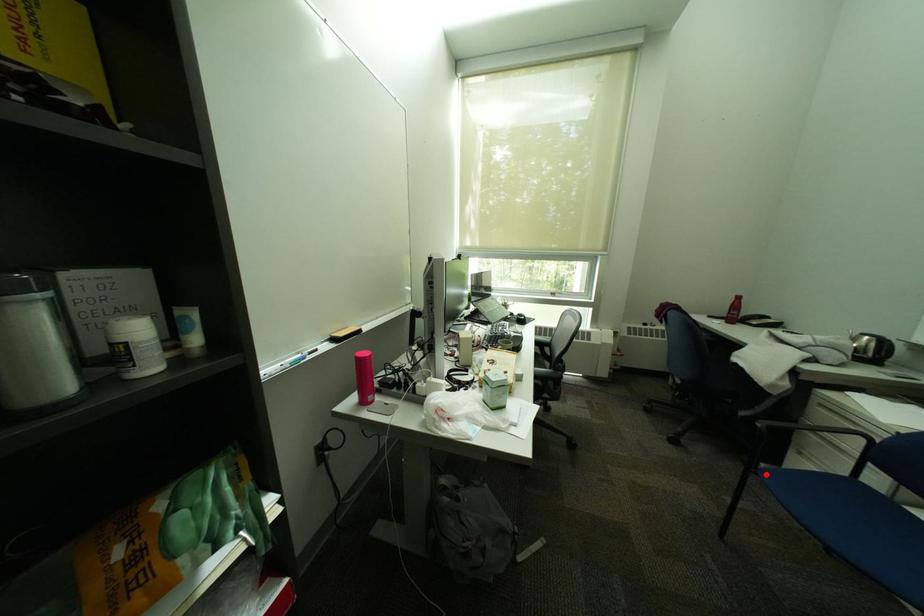
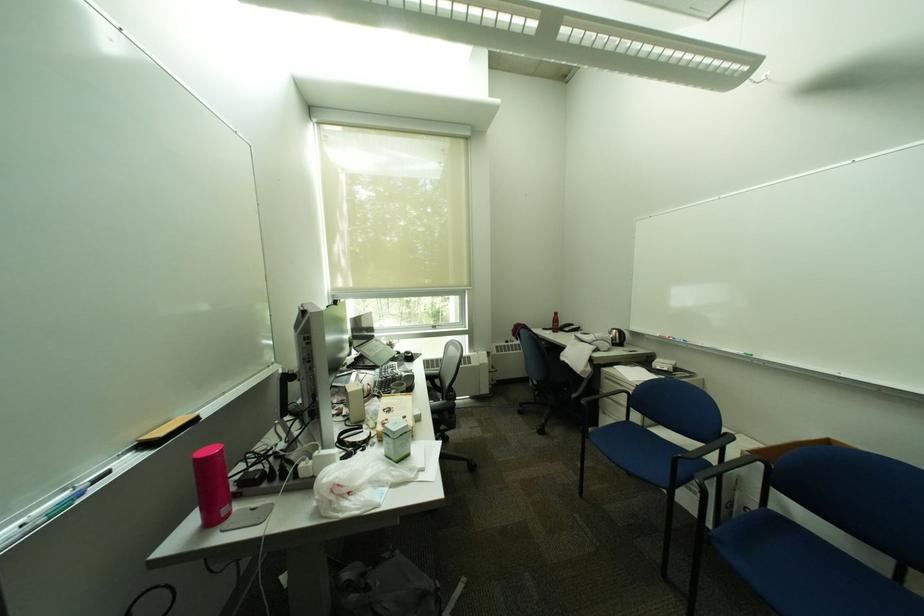
Find the pixel in the second image that matches the highlighted location in the first image.

(599, 439)